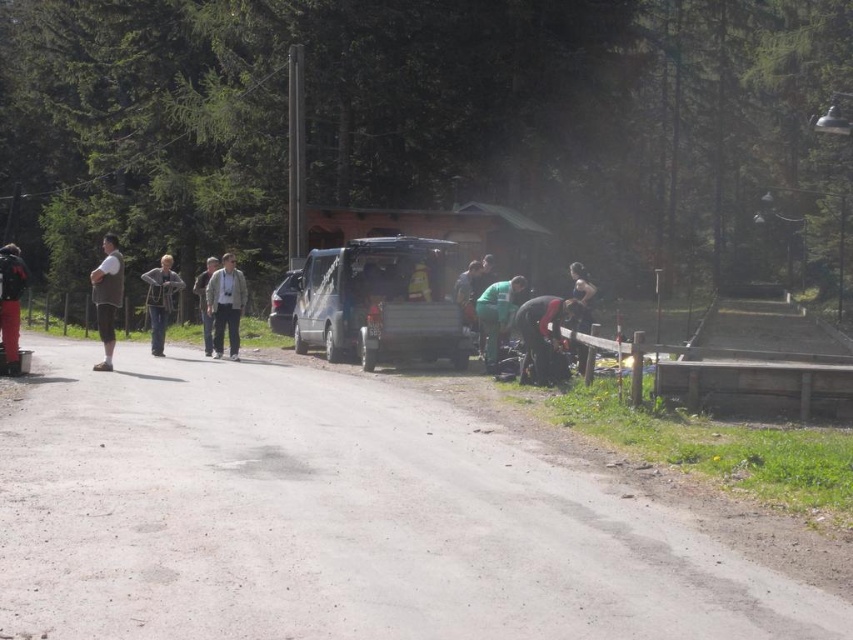
Question: Is light brown leather jacket at center behind green fabric jacket at center?

Choices:
 (A) no
 (B) yes

Answer: (B)

Question: Can you confirm if denim jacket at left is thinner than satin silver van at center?

Choices:
 (A) no
 (B) yes

Answer: (A)

Question: Estimate the real-world distances between objects in this image. Which object is farther from the denim jacket at left?

Choices:
 (A) yellow reflective vest at center
 (B) light brown leather jacket at center
 (C) dark gray fabric jacket at lower right

Answer: (C)

Question: Which point is farther to the camera?

Choices:
 (A) matte black camera at left
 (B) green fabric pants at lower center
 (C) gray fabric jacket at center
 (D) green fabric jacket at center

Answer: (C)

Question: Which point is farther to the camera?

Choices:
 (A) (276, 321)
 (B) (100, 310)
 (C) (161, 268)

Answer: (A)

Question: Is denim jacket at left positioned before green fabric jacket at center?

Choices:
 (A) yes
 (B) no

Answer: (A)